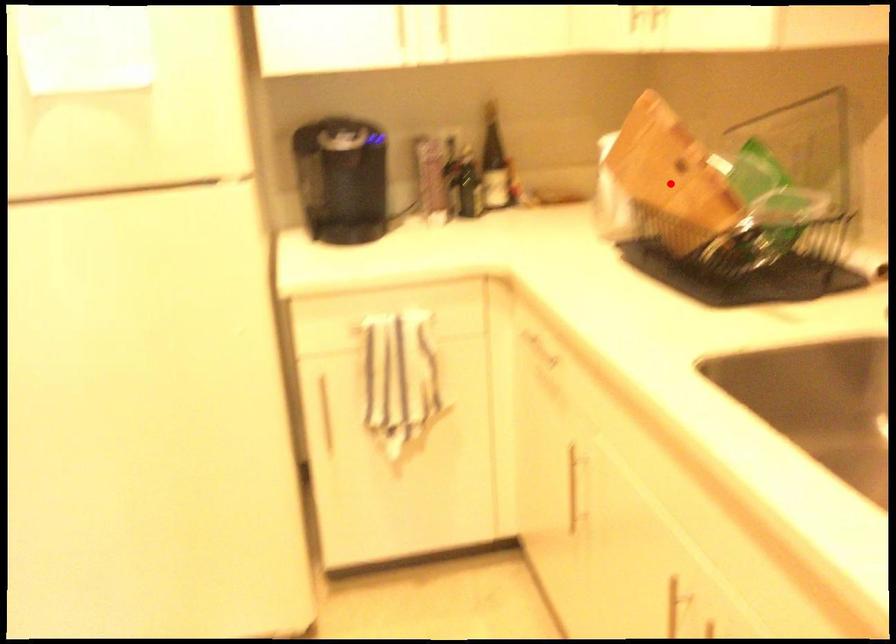
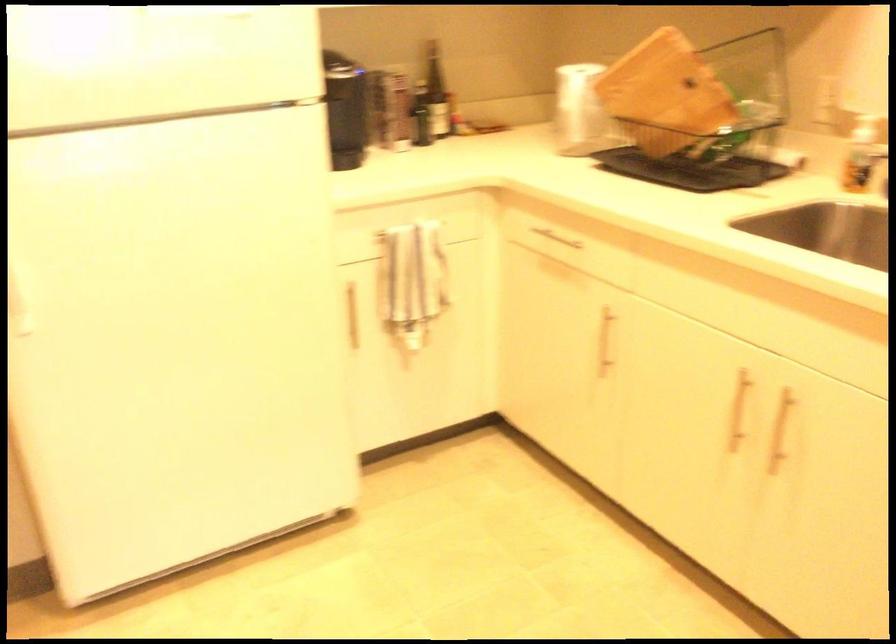
Find the pixel in the second image that matches the highlighted location in the first image.

(665, 93)